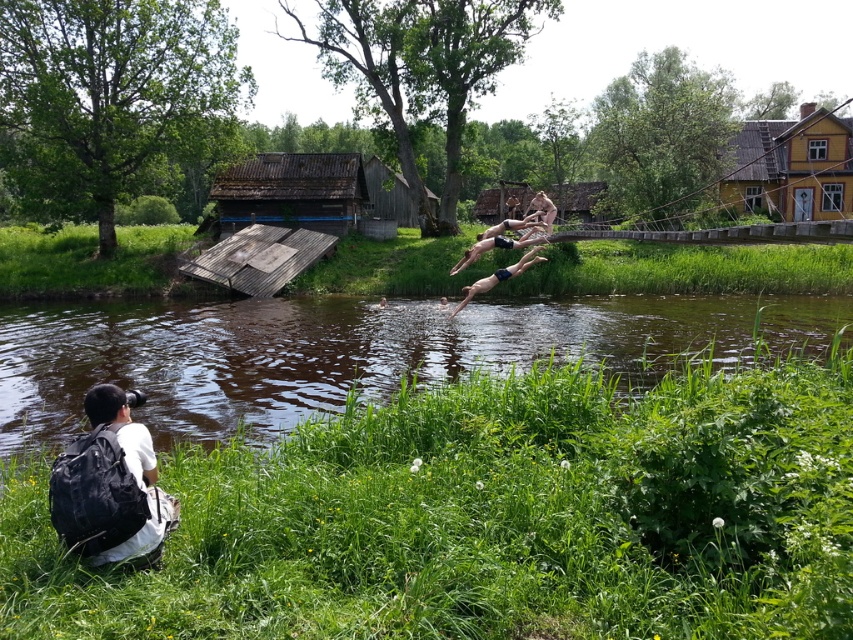
Is smooth skin person at center to the left of nude human at upper center from the viewer's perspective?

Indeed, smooth skin person at center is positioned on the left side of nude human at upper center.

Is point (479, 234) positioned after point (552, 205)?

That is True.

The image size is (853, 640). I want to click on smooth skin person at center, so click(x=512, y=225).

In the scene shown: Who is lower down, smooth skin divers at center or smooth skin person at center?

smooth skin divers at center is below.

This screenshot has width=853, height=640. What are the coordinates of `smooth skin divers at center` in the screenshot? It's located at (498, 240).

Locate an element on the screen. The width and height of the screenshot is (853, 640). smooth skin divers at center is located at coordinates (498, 240).

Does brown murky water at center have a greater height compared to smooth skin divers at center?

Yes, brown murky water at center is taller than smooth skin divers at center.

Is brown murky water at center wider than smooth skin divers at center?

Yes, brown murky water at center is wider than smooth skin divers at center.

Is point (136, 358) positioned behind point (524, 225)?

No.

In order to click on brown murky water at center in this screenshot , I will do `click(354, 353)`.